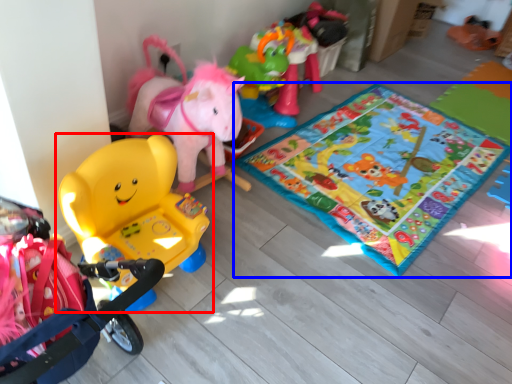
Question: Which of the following is the farthest to the observer, toy (highlighted by a red box) or yoga mat (highlighted by a blue box)?

Choices:
 (A) toy
 (B) yoga mat

Answer: (B)